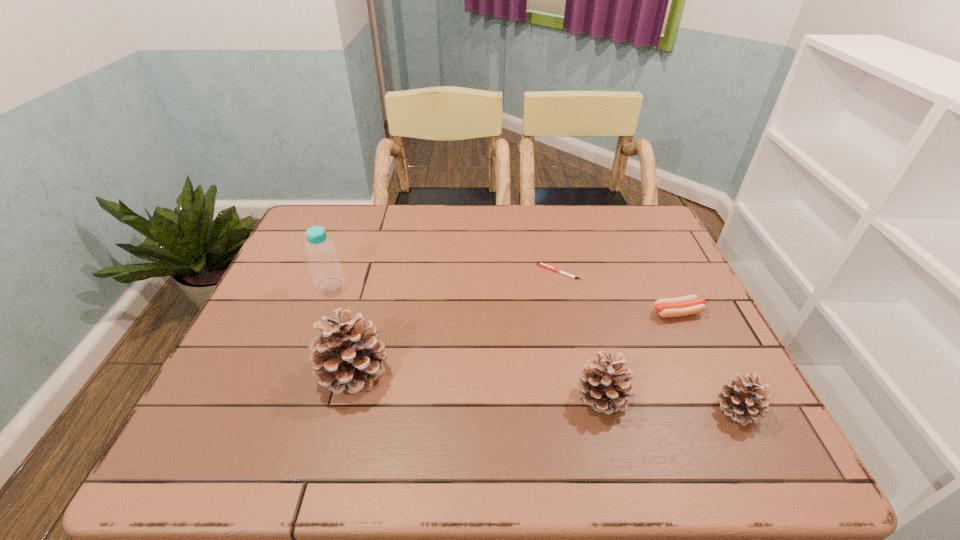
Please mark a free spot for a new pinecone to balance the arrangement. Please provide its 2D coordinates. Your answer should be formatted as a tuple, i.e. [(x, y)], where the tuple contains the x and y coordinates of a point satisfying the conditions above.

[(475, 384)]